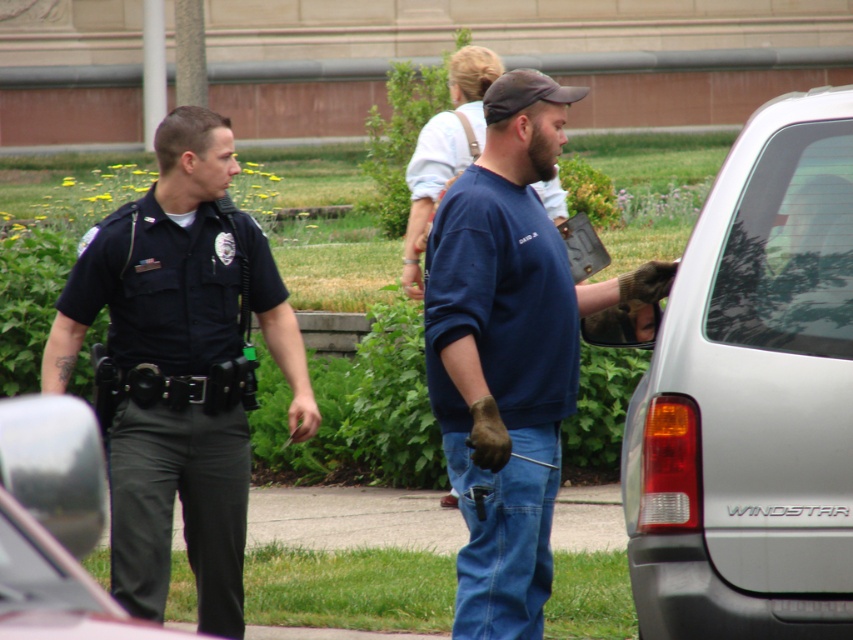
Does silver metallic van at right appear on the left side of black matte pants at left?

Incorrect, silver metallic van at right is not on the left side of black matte pants at left.

Which is above, silver metallic van at right or black matte pants at left?

Positioned higher is black matte pants at left.

Locate an element on the screen. silver metallic van at right is located at coordinates pyautogui.click(x=752, y=396).

You are a GUI agent. You are given a task and a screenshot of the screen. Output one action in this format:
    pyautogui.click(x=<x>, y=<y>)
    Task: Click on the silver metallic van at right
    
    Given the screenshot: What is the action you would take?
    pyautogui.click(x=752, y=396)

Does dark blue uniform at left have a smaller size compared to blue cotton shirt at center?

No, dark blue uniform at left is not smaller than blue cotton shirt at center.

Which is behind, point (132, 308) or point (469, 212)?

Positioned behind is point (132, 308).

This screenshot has width=853, height=640. Identify the location of dark blue uniform at left. (178, 368).

Can you confirm if blue cotton shirt at center is taller than blue cotton sweatshirt at center?

Yes.

Between point (450, 422) and point (422, 160), which one is positioned behind?

The point (422, 160) is behind.

Describe the element at coordinates (509, 352) in the screenshot. This screenshot has height=640, width=853. I see `blue cotton shirt at center` at that location.

This screenshot has height=640, width=853. What are the coordinates of `blue cotton shirt at center` in the screenshot? It's located at (509, 352).